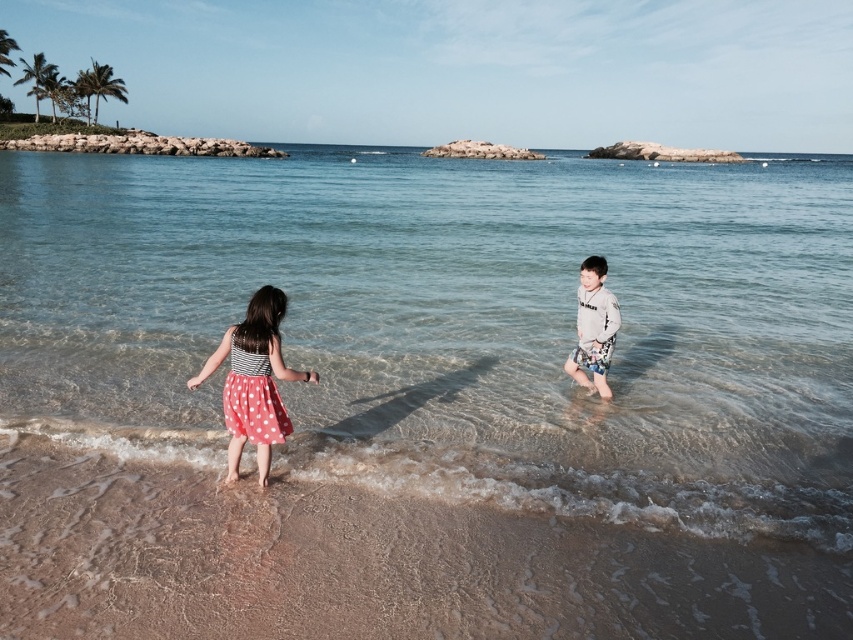
Question: Can you confirm if polka dot fabric dress at lower left is positioned above light gray cotton shirt at center?

Choices:
 (A) no
 (B) yes

Answer: (A)

Question: Which object appears farthest from the camera in this image?

Choices:
 (A) brown sandy beach at lower center
 (B) polka dot fabric dress at lower left

Answer: (B)

Question: Which point is closer to the camera?

Choices:
 (A) polka dot fabric dress at lower left
 (B) clear water at center
 (C) light gray cotton shirt at center

Answer: (A)

Question: Is brown sandy beach at lower center below light gray cotton shirt at center?

Choices:
 (A) no
 (B) yes

Answer: (B)

Question: In this image, where is clear water at center located relative to light gray cotton shirt at center?

Choices:
 (A) right
 (B) left

Answer: (B)

Question: Among these objects, which one is nearest to the camera?

Choices:
 (A) polka dot fabric dress at lower left
 (B) light gray cotton shirt at center
 (C) brown sandy beach at lower center
 (D) clear water at center

Answer: (C)